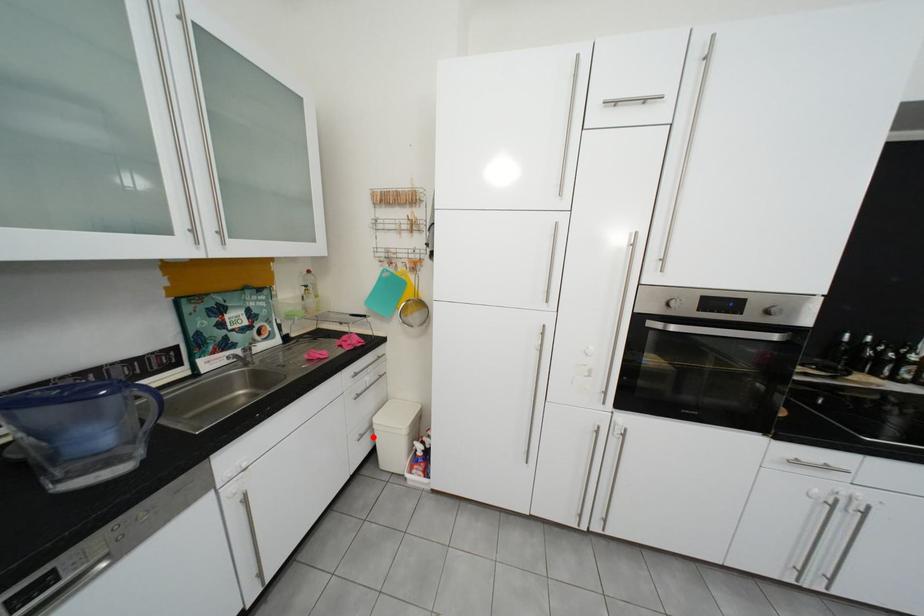
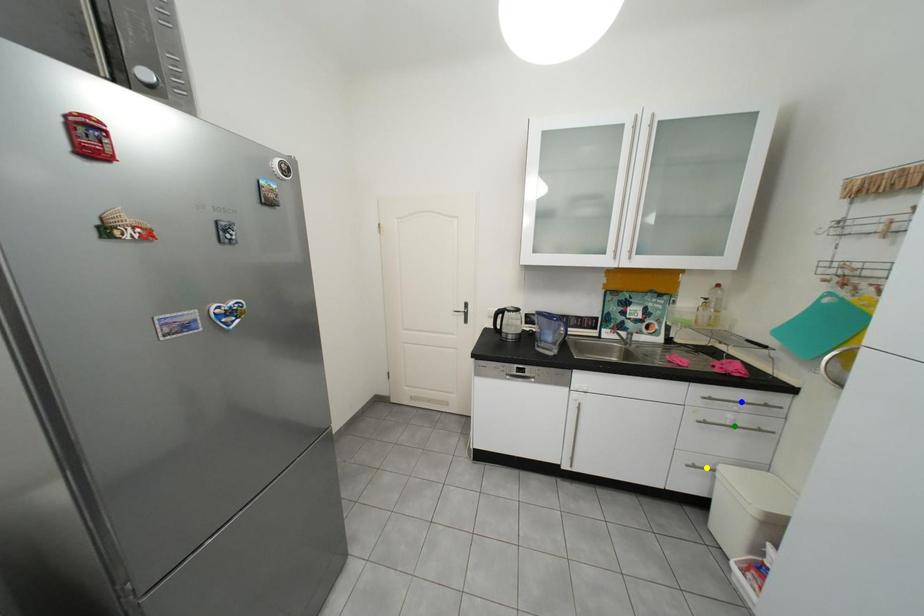
Question: I am providing you with two images of the same scene from different viewpoints. A red point is marked on the first image. You are given multiple points on the second image. Which point in image 2 represents the same 3d spot as the red point in image 1?

Choices:
 (A) yellow point
 (B) blue point
 (C) green point

Answer: (A)